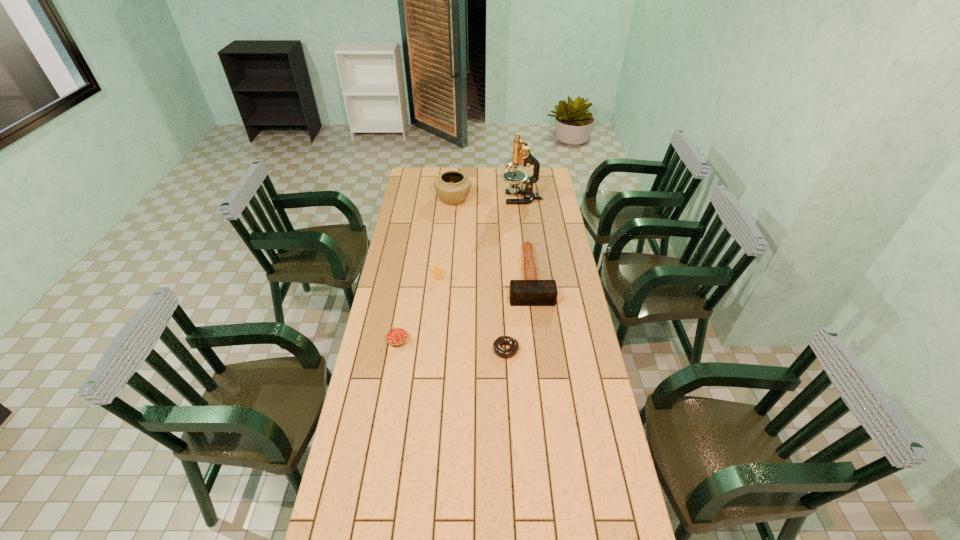
This screenshot has width=960, height=540. Find the location of `vacant space at the right edge of the desktop`. vacant space at the right edge of the desktop is located at coordinates (582, 320).

Where is `free spot between the microscope and the fifth shortest object`? free spot between the microscope and the fifth shortest object is located at coordinates (488, 199).

At what (x,y) coordinates should I click in order to perform the action: click on empty location between the tallest object and the Lego. Please return your answer as a coordinate pair (x, y). Looking at the image, I should click on (480, 239).

At what (x,y) coordinates should I click in order to perform the action: click on empty space between the mallet and the tallest object. Please return your answer as a coordinate pair (x, y). Looking at the image, I should click on [525, 237].

Identify the location of unoccupied area between the strawberry and the tallest object. The image size is (960, 540). (460, 269).

Locate an element on the screen. The image size is (960, 540). unoccupied position between the doughnut and the pottery is located at coordinates (480, 274).

Locate an element on the screen. Image resolution: width=960 pixels, height=540 pixels. vacant area that lies between the microscope and the second tallest object is located at coordinates (488, 199).

The height and width of the screenshot is (540, 960). Find the location of `vacant area that lies between the doughnut and the leftmost object`. vacant area that lies between the doughnut and the leftmost object is located at coordinates (452, 345).

What are the coordinates of `free space between the mallet and the pottery` in the screenshot? It's located at (492, 238).

Identify the location of free spot between the shortest object and the second tallest object. This screenshot has width=960, height=540. (480, 274).